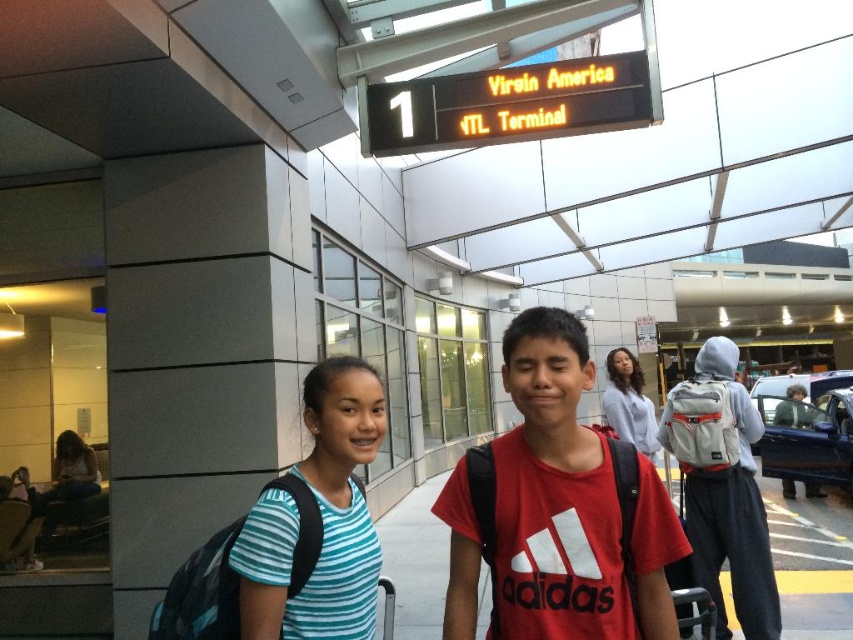
Between striped fabric shirt at center and red matte adidas shirt at center, which one has less height?

Standing shorter between the two is red matte adidas shirt at center.

Is point (519, 577) behind point (453, 538)?

No, (519, 577) is in front of (453, 538).

Is point (676, 544) closer to camera compared to point (509, 611)?

That is False.

Locate an element on the screen. striped fabric shirt at center is located at coordinates (599, 512).

Does red matte adidas shirt at center have a lesser height compared to teal striped shirt at center?

No, red matte adidas shirt at center is not shorter than teal striped shirt at center.

Describe the element at coordinates (572, 502) in the screenshot. I see `red matte adidas shirt at center` at that location.

Does point (614, 508) come closer to viewer compared to point (328, 608)?

Yes, it is.

The width and height of the screenshot is (853, 640). In order to click on red matte adidas shirt at center in this screenshot , I will do `click(572, 502)`.

Who is shorter, striped fabric shirt at center or teal striped shirt at center?

teal striped shirt at center is shorter.

Is striped fabric shirt at center positioned before teal striped shirt at center?

No, it is behind teal striped shirt at center.

Is point (502, 508) less distant than point (305, 385)?

Yes, it is in front of point (305, 385).

Identify the location of striped fabric shirt at center. Image resolution: width=853 pixels, height=640 pixels. pos(599,512).